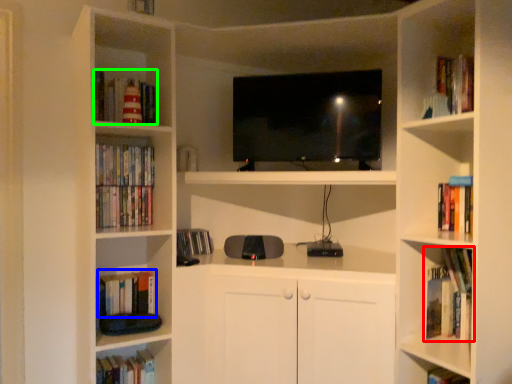
Question: Estimate the real-world distances between objects in this image. Which object is closer to book (highlighted by a red box), book (highlighted by a blue box) or book (highlighted by a green box)?

Choices:
 (A) book
 (B) book

Answer: (A)